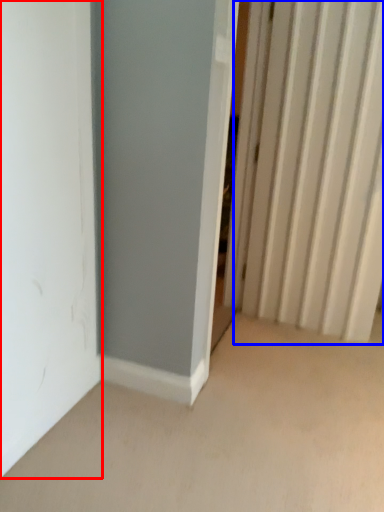
Question: Which object appears closest to the camera in this image, door (highlighted by a red box) or radiator (highlighted by a blue box)?

Choices:
 (A) door
 (B) radiator

Answer: (A)